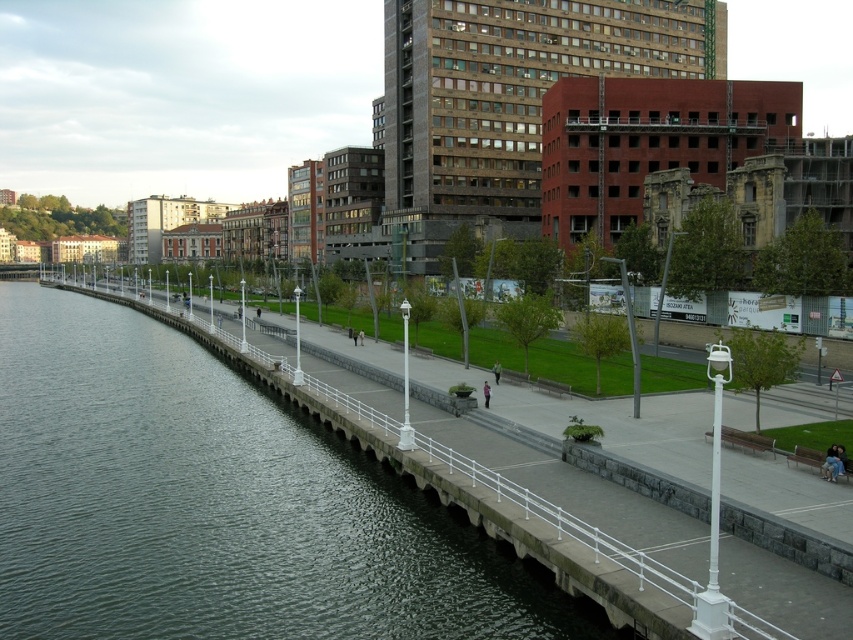
Question: Is green concrete river at lower left positioned at the back of pink fabric person at center?

Choices:
 (A) yes
 (B) no

Answer: (B)

Question: Which point appears farthest from the camera in this image?

Choices:
 (A) (828, 493)
 (B) (165, 376)

Answer: (B)

Question: Which is nearer to the white concrete walkway at lower left?

Choices:
 (A) pink fabric person at center
 (B) green concrete river at lower left

Answer: (B)

Question: Which point is farther to the camera?

Choices:
 (A) (318, 612)
 (B) (840, 490)

Answer: (B)

Question: From the image, what is the correct spatial relationship of green concrete river at lower left in relation to white concrete walkway at lower left?

Choices:
 (A) right
 (B) left

Answer: (B)

Question: Does white concrete walkway at lower left appear on the right side of pink fabric person at center?

Choices:
 (A) yes
 (B) no

Answer: (A)